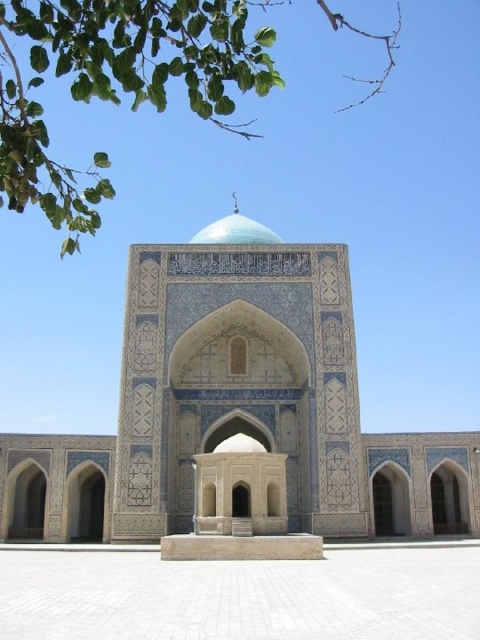
You are an architect analyzing the spatial relationship between the green leafy tree at upper left and the teal glazed dome at center in the image. Which object is positioned higher relative to the other?

The green leafy tree at upper left is located above the teal glazed dome at center, so it is positioned higher.

You are standing in front of the mosque and want to take a photo that includes both the green leafy tree at upper left and the teal glazed dome at center. Which object should you position on the left side of your photo to include both in the frame?

You should position the green leafy tree at upper left on the left side of your photo since it is already to the left of the teal glazed dome at center.

You are standing in front of the mosque or mausoleum with intricate Islamic design. You notice a point labeled at coordinates (117,84). What object is located at this point?

The point at coordinates (117,84) indicates a green leafy tree at upper left.